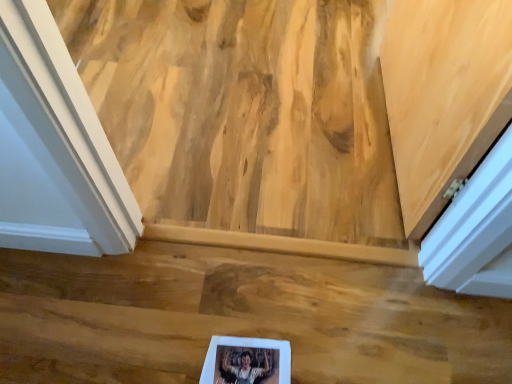
Question: Is white matte picture frame at lower center positioned with its back to wooden floor at center?

Choices:
 (A) yes
 (B) no

Answer: (A)

Question: From the image's perspective, is white matte picture frame at lower center located above wooden floor at center?

Choices:
 (A) yes
 (B) no

Answer: (B)

Question: Is the depth of white matte picture frame at lower center greater than that of wooden floor at center?

Choices:
 (A) yes
 (B) no

Answer: (B)

Question: Are white matte picture frame at lower center and wooden floor at center far apart?

Choices:
 (A) yes
 (B) no

Answer: (B)

Question: Is white matte picture frame at lower center wider than wooden floor at center?

Choices:
 (A) yes
 (B) no

Answer: (B)

Question: Would you say white matte picture frame at lower center contains wooden floor at center?

Choices:
 (A) yes
 (B) no

Answer: (B)

Question: From the image's perspective, is wooden floor at center below white matte picture frame at lower center?

Choices:
 (A) no
 (B) yes

Answer: (A)

Question: Is wooden floor at center oriented towards white matte picture frame at lower center?

Choices:
 (A) yes
 (B) no

Answer: (A)

Question: Does wooden floor at center have a greater width compared to white matte picture frame at lower center?

Choices:
 (A) no
 (B) yes

Answer: (B)

Question: Considering the relative sizes of wooden floor at center and white matte picture frame at lower center in the image provided, is wooden floor at center thinner than white matte picture frame at lower center?

Choices:
 (A) yes
 (B) no

Answer: (B)

Question: Is the position of wooden floor at center less distant than that of white matte picture frame at lower center?

Choices:
 (A) yes
 (B) no

Answer: (B)

Question: Can you confirm if wooden floor at center is taller than white matte picture frame at lower center?

Choices:
 (A) no
 (B) yes

Answer: (B)

Question: From a real-world perspective, relative to wooden floor at center, is white matte picture frame at lower center vertically above or below?

Choices:
 (A) above
 (B) below

Answer: (B)